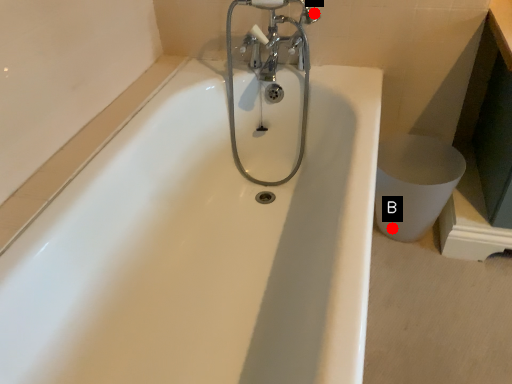
Question: Two points are circled on the image, labeled by A and B beside each circle. Which point is further to the camera?

Choices:
 (A) A is further
 (B) B is further

Answer: (B)